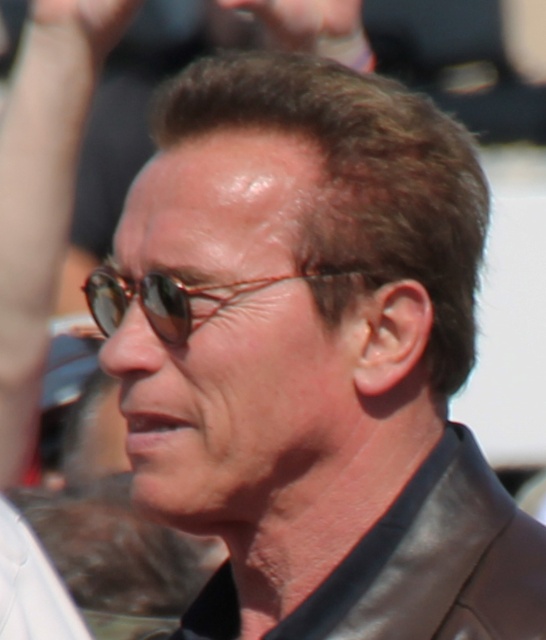
Question: Which point appears farthest from the camera in this image?

Choices:
 (A) (464, 500)
 (B) (94, 298)

Answer: (B)

Question: Does leather jacket at center appear on the right side of sunglasses at center?

Choices:
 (A) yes
 (B) no

Answer: (A)

Question: Can you confirm if leather jacket at center is bigger than sunglasses at center?

Choices:
 (A) no
 (B) yes

Answer: (B)

Question: From the image, what is the correct spatial relationship of leather jacket at center in relation to sunglasses at center?

Choices:
 (A) below
 (B) above

Answer: (A)

Question: Which point is farther from the camera taking this photo?

Choices:
 (A) (168, 312)
 (B) (448, 500)

Answer: (B)